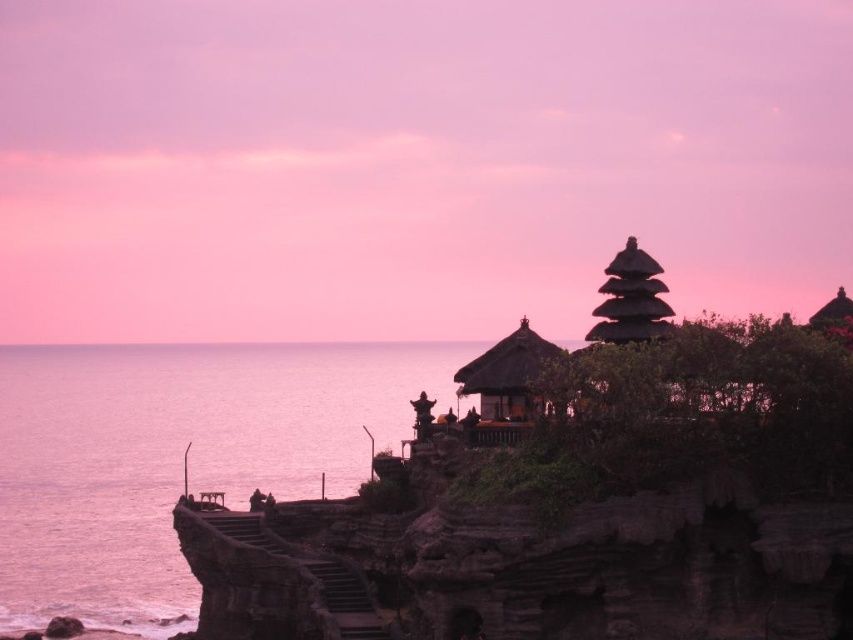
You are a photographer wanting to capture the wooden thatched roof gazebo at center and the transparent water at left in the same frame. Which object should you position closer to the left edge of your camera viewfinder to include both?

The transparent water at left should be positioned closer to the left edge of your camera viewfinder since it is already on the left side of the wooden thatched roof gazebo at center, allowing both to be captured in the frame.

You are a photographer planning to capture the entire scene in one shot. Given that your camera has a limited field of view, which object should you position first to ensure both the transparent water at left and the matte brown pagoda at upper right are fully visible?

You should position the camera to first include the transparent water at left because it might be wider than the matte brown pagoda at upper right, ensuring both fit within the frame.

You are an architect planning to build a new structure on the coast. You want to ensure that the new structure doesn not block the view of both the wooden thatched roof gazebo at center and the matte brown pagoda at upper right from the shore. Given their sizes, which structure would require more space between the new building and itself to maintain visibility?

The wooden thatched roof gazebo at center is bigger than the matte brown pagoda at upper right, so it would require more space between the new building and itself to maintain visibility.